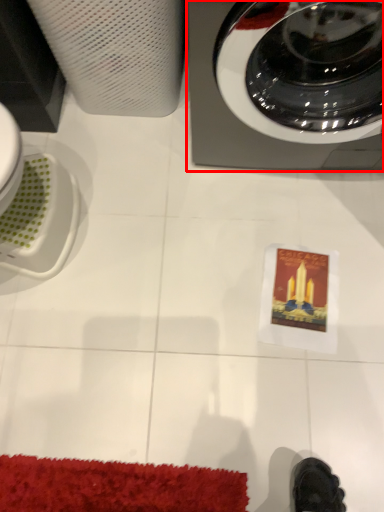
Question: Where is home appliance (annotated by the red box) located in relation to paper towel in the image?

Choices:
 (A) left
 (B) right

Answer: (B)